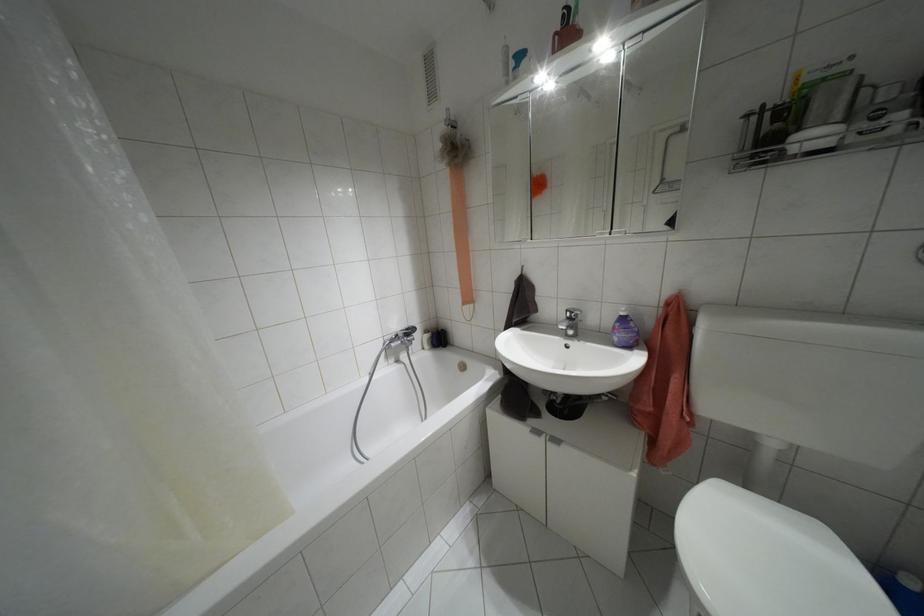
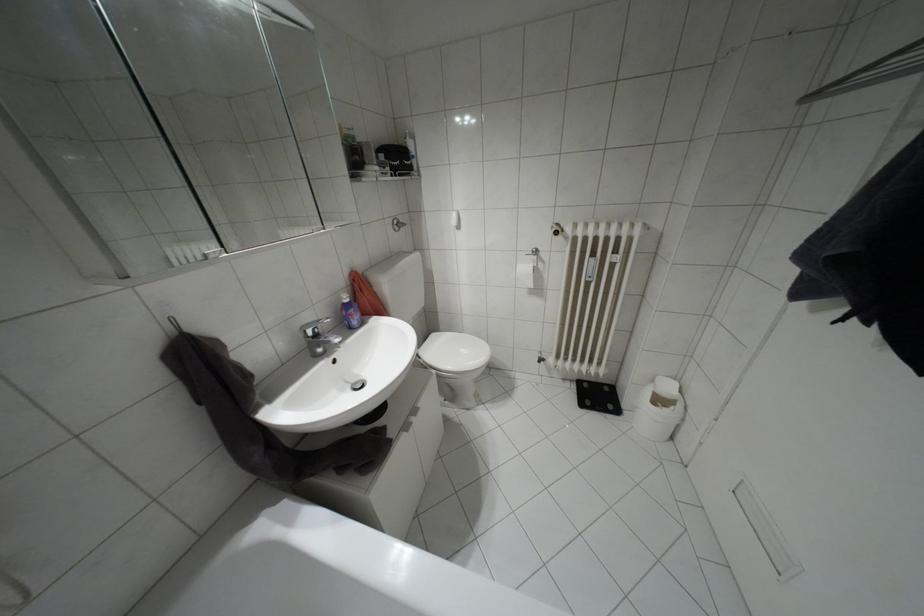
The images are taken continuously from a first-person perspective. In which direction is your viewpoint rotating?

The camera's rotation is toward right-down.